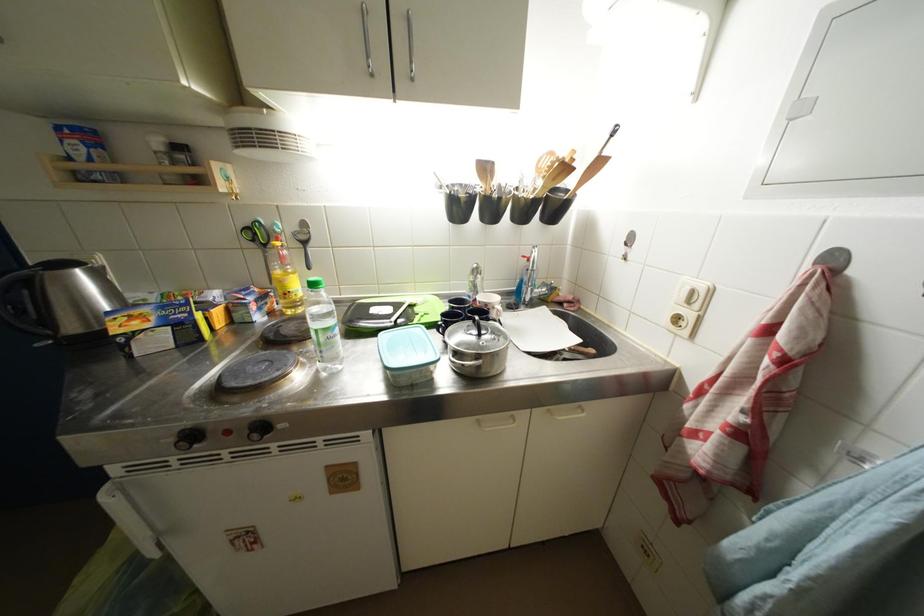
Where is `plastic water bottle`? This screenshot has height=616, width=924. plastic water bottle is located at coordinates (322, 326).